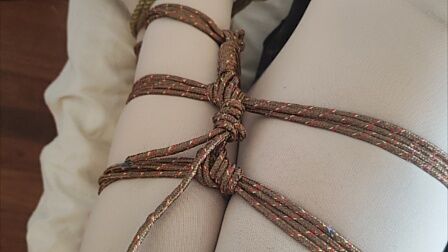
Locate an element on the screen. The width and height of the screenshot is (448, 252). cord is located at coordinates (177, 83), (161, 168), (179, 187), (179, 148), (182, 12), (141, 6), (339, 120), (321, 232).